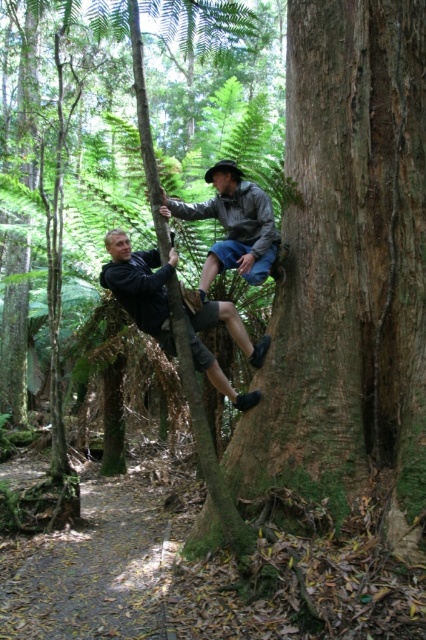
Consider the image. Is green mossy tree trunk at center positioned at the back of gray fabric jacket at center?

No.

Find the location of a particular element. green mossy tree trunk at center is located at coordinates (348, 266).

Locate an element on the screen. This screenshot has height=640, width=426. green mossy tree trunk at center is located at coordinates (348, 266).

Looking at this image, can you confirm if green mossy tree trunk at center is wider than matte black jacket at left?

Correct, the width of green mossy tree trunk at center exceeds that of matte black jacket at left.

Does green mossy tree trunk at center appear on the right side of matte black jacket at left?

Indeed, green mossy tree trunk at center is positioned on the right side of matte black jacket at left.

Is point (333, 100) more distant than point (132, 308)?

Yes, it is.

Find the location of a particular element. green mossy tree trunk at center is located at coordinates (348, 266).

Which is above, matte black jacket at left or gray fabric jacket at center?

Positioned higher is gray fabric jacket at center.

Can you confirm if matte black jacket at left is smaller than gray fabric jacket at center?

Actually, matte black jacket at left might be larger than gray fabric jacket at center.

Is point (106, 272) closer to camera compared to point (172, 198)?

Yes, it is in front of point (172, 198).

Find the location of `matte black jacket at left`. matte black jacket at left is located at coordinates (141, 285).